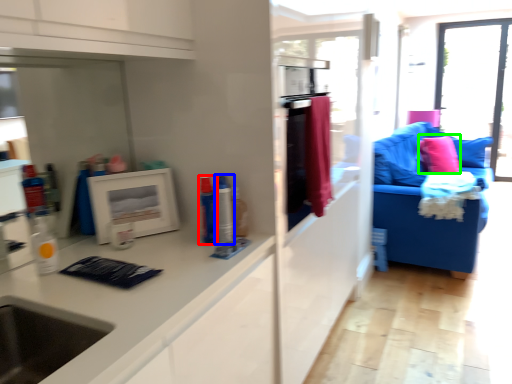
Question: Considering the real-world distances, which object is closest to toiletry (highlighted by a red box)? toiletry (highlighted by a blue box) or pillow (highlighted by a green box).

Choices:
 (A) toiletry
 (B) pillow

Answer: (A)